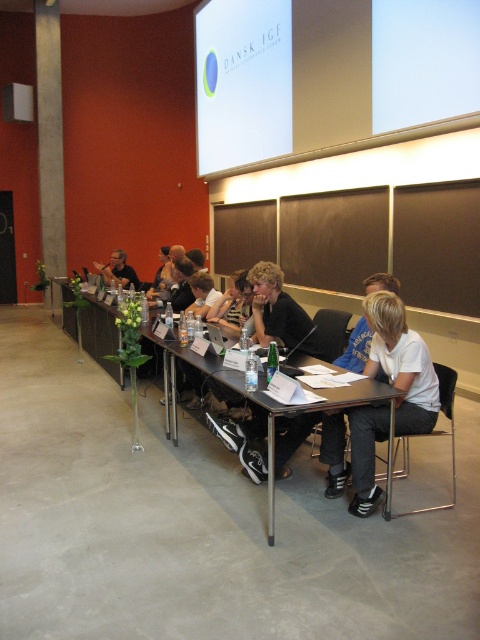
You are an event organizer arranging a presentation. You need to ensure that the white glossy projection screen at upper center is visible to all attendees seated around the black plastic table at center. Based on their positions, is the screen placed in a suitable location for the presentation?

The white glossy projection screen at upper center is positioned over the black plastic table at center, which means it is directly above the table. This placement might block the view of the screen for attendees sitting at the table, making it unsuitable for a presentation where visibility is crucial.

Consider the image. You are standing in the room and want to place a 3 meter long banner on the floor in front of the black plastic table at center. Is there enough space between you and the table to lay it out fully?

The black plastic table at center is 2.88 meters away from the viewer. Since the banner is 3 meters long, the distance is insufficient as the table is closer than the banner length. You would need at least 3 meters of space to fully lay it out.

You are organizing a presentation and need to decide where to place your laptop. The white glossy projection screen at upper center and the black plastic table at center are both options. Which surface is bigger and thus better for placing a larger laptop?

The white glossy projection screen at upper center is larger in size than the black plastic table at center, so it is better for placing a larger laptop.